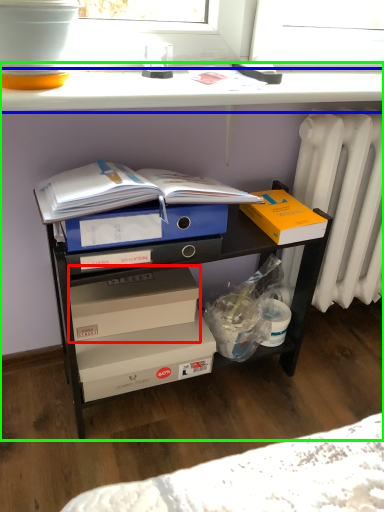
Question: Considering the real-world distances, which object is farthest from box (highlighted by a red box)? window sill (highlighted by a blue box) or desk (highlighted by a green box)?

Choices:
 (A) window sill
 (B) desk

Answer: (A)